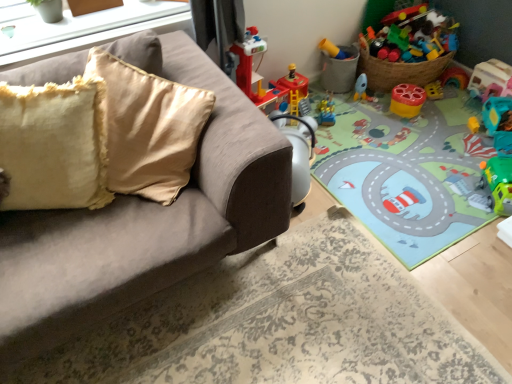
Where is `vacant space that's between rubber duck at lower right, marked as the fifth toy in a left-to-right arrangement, and translucent plastic toy at center, the 1th toy positioned from the left`? vacant space that's between rubber duck at lower right, marked as the fifth toy in a left-to-right arrangement, and translucent plastic toy at center, the 1th toy positioned from the left is located at coordinates (404, 123).